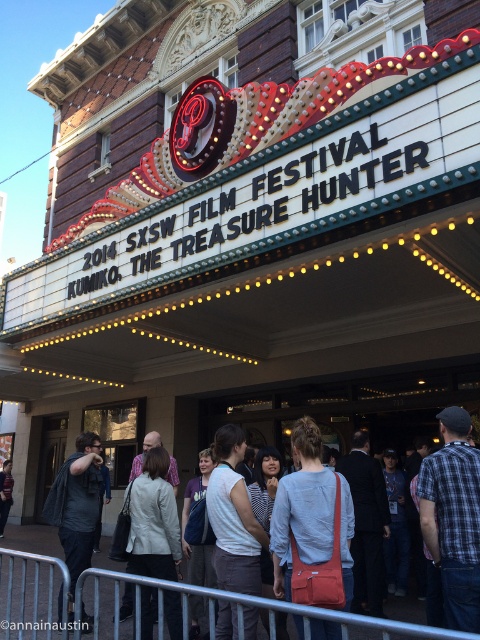
Question: Considering the relative positions of white fabric shirt at center and striped shirt at center in the image provided, where is white fabric shirt at center located with respect to striped shirt at center?

Choices:
 (A) above
 (B) below

Answer: (A)

Question: Which object is the closest to the plaid fabric shirt at center?

Choices:
 (A) dark gray fabric jacket at center
 (B) striped shirt at center

Answer: (A)

Question: Estimate the real-world distances between objects in this image. Which object is farther from the striped shirt at center?

Choices:
 (A) white fabric shirt at center
 (B) light gray cotton shirt at center

Answer: (A)

Question: Which point is farther to the camera?

Choices:
 (A) (437, 488)
 (B) (175, 630)

Answer: (B)

Question: Can you confirm if light gray cotton shirt at center is thinner than white fabric shirt at center?

Choices:
 (A) yes
 (B) no

Answer: (B)

Question: Is plaid fabric shirt at center wider than light beige jacket at center?

Choices:
 (A) no
 (B) yes

Answer: (A)